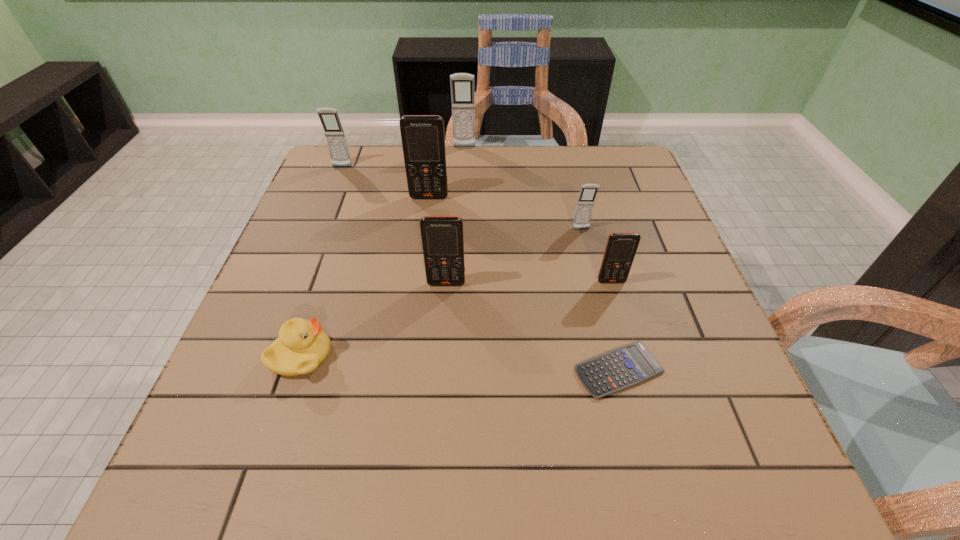
Find the location of a particular element. free location at the far left corner of the desktop is located at coordinates (341, 182).

The height and width of the screenshot is (540, 960). In order to click on free space at the near left corner in this screenshot , I will do `click(183, 470)`.

Locate an element on the screen. The image size is (960, 540). free region at the far right corner of the desktop is located at coordinates (631, 167).

What are the coordinates of `empty space that is in between the rightmost orange cellular telephone and the biggest gray cellular telephone` in the screenshot? It's located at (538, 214).

I want to click on vacant space in between the second biggest orange cellular telephone and the second farthest gray cellular telephone, so click(x=395, y=225).

Identify the location of vacant point located between the rightmost orange cellular telephone and the fifth nearest object. (596, 255).

Find the location of a particular element. The width and height of the screenshot is (960, 540). free spot between the farthest cellular telephone and the second biggest orange cellular telephone is located at coordinates (455, 215).

Where is `vacant space that's between the farthest gray cellular telephone and the second smallest orange cellular telephone`? Image resolution: width=960 pixels, height=540 pixels. vacant space that's between the farthest gray cellular telephone and the second smallest orange cellular telephone is located at coordinates (455, 215).

Identify the location of free point between the yellow duckling and the second biggest orange cellular telephone. The image size is (960, 540). (374, 320).

The width and height of the screenshot is (960, 540). I want to click on free space between the seventh nearest object and the second smallest orange cellular telephone, so click(x=395, y=225).